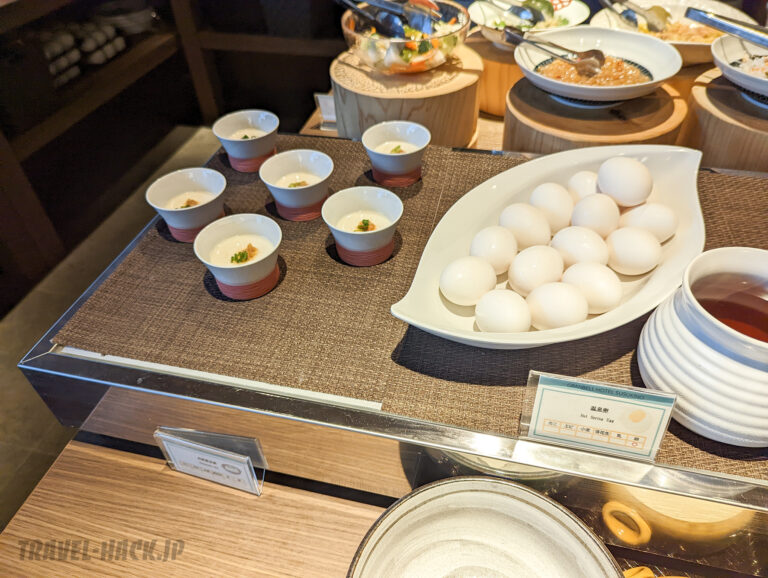
You are a GUI agent. You are given a task and a screenshot of the screen. Output one action in this format:
    pyautogui.click(x=<x>, y=<y>)
    Task: Click on the metal utensil
    
    Given the screenshot: What is the action you would take?
    pyautogui.click(x=538, y=45)